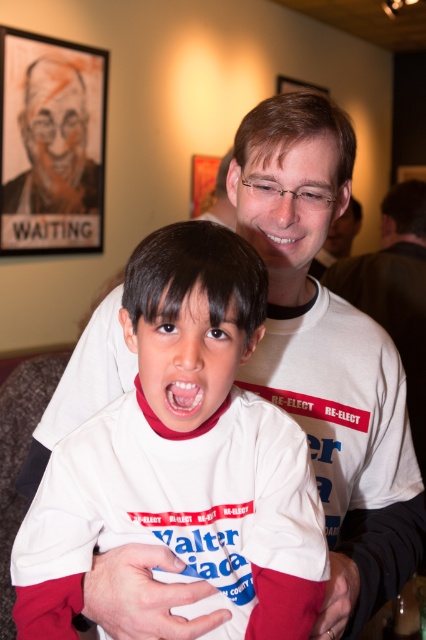
You are a photographer at the event and need to ensure both the white cotton shirt at center and the bright white teeth at center are visible in the photo. Which object should you focus on to ensure both are in frame?

You should focus on the white cotton shirt at center because it is larger than the bright white teeth at center, so ensuring the shirt is in frame will naturally include the teeth as well.

You are a photographer at the event and want to capture a closeup of the white cotton shirt at center and the bright white teeth at center in one frame. Given that your camera has a maximum focus range of 5 inches, will you be able to achieve this?

The white cotton shirt at center and the bright white teeth at center are 5.25 inches apart from each other. Since the distance exceeds the camera maximum focus range of 5 inches, the photographer cannot capture both in one frame.

You are a photographer setting up for a photo shoot in the same room. You need to place a 3 feet wide backdrop between the black paper picture frame at upper left and the wooden picture frame at upper center. Is there enough space between them to fit the backdrop?

The distance between the black paper picture frame at upper left and the wooden picture frame at upper center is 7.42 feet. Since the backdrop is 3 feet wide, there is sufficient space as 7.42 feet is greater than 3 feet.